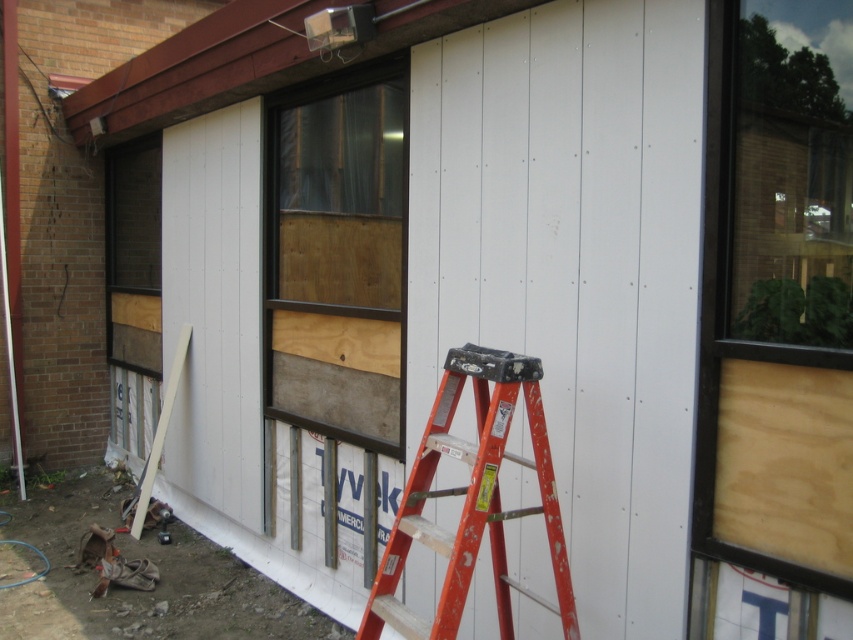
Question: Which object is the farthest from the wooden paneling at left?

Choices:
 (A) transparent glass window at upper right
 (B) white smooth siding at center
 (C) brown wood window at center

Answer: (A)

Question: Can you confirm if metallic orange ladder at center is smaller than wooden paneling at left?

Choices:
 (A) yes
 (B) no

Answer: (A)

Question: Does white smooth siding at center come behind brown wood window at center?

Choices:
 (A) yes
 (B) no

Answer: (B)

Question: In this image, where is white smooth siding at center located relative to wooden paneling at left?

Choices:
 (A) below
 (B) above

Answer: (A)

Question: Among these points, which one is nearest to the camera?

Choices:
 (A) (404, 141)
 (B) (445, 392)
 (C) (386, 320)

Answer: (B)

Question: Considering the real-world distances, which object is farthest from the wooden paneling at left?

Choices:
 (A) metallic orange ladder at center
 (B) brown wood window at center
 (C) white smooth siding at center
 (D) transparent glass window at upper right

Answer: (D)